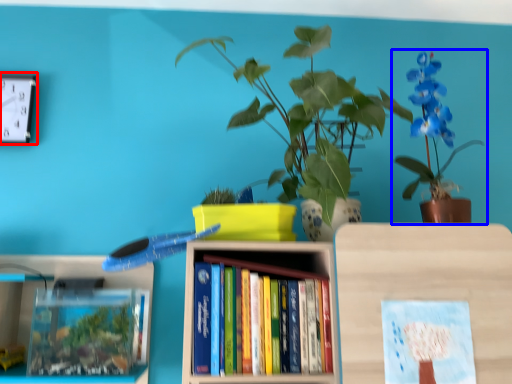
Question: Which of the following is the closest to the observer, clock (highlighted by a red box) or houseplant (highlighted by a blue box)?

Choices:
 (A) clock
 (B) houseplant

Answer: (B)